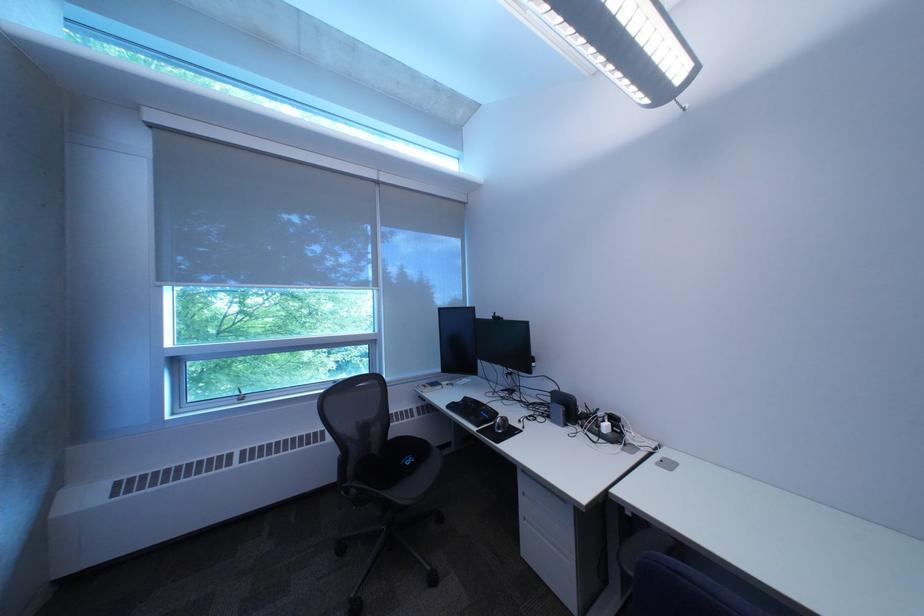
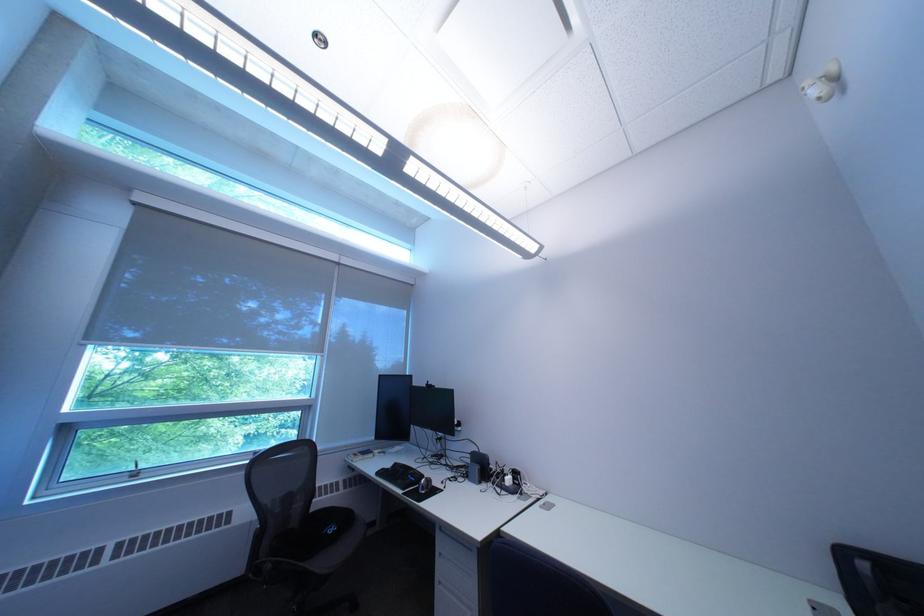
Question: The first image is from the beginning of the video and the second image is from the end. How did the camera likely rotate when shooting the video?

Choices:
 (A) Left
 (B) Right
 (C) Up
 (D) Down

Answer: (C)